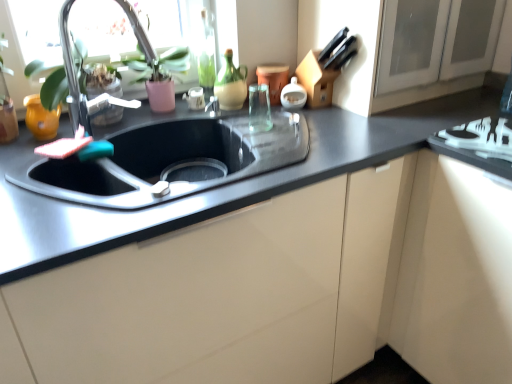
Where is `empty space that is in between matte yellow vase at left, marked as the 1th appliance in a left-to-right arrangement, and white glossy coffee cup at center, the second appliance positioned from the left`? This screenshot has height=384, width=512. empty space that is in between matte yellow vase at left, marked as the 1th appliance in a left-to-right arrangement, and white glossy coffee cup at center, the second appliance positioned from the left is located at coordinates (146, 120).